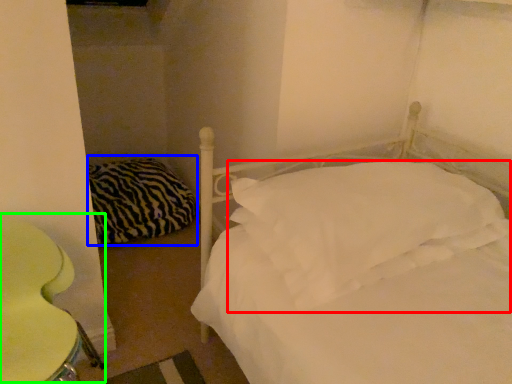
Question: Considering the real-world distances, which object is closest to pillow (highlighted by a red box)? pillow (highlighted by a blue box) or swivel chair (highlighted by a green box).

Choices:
 (A) pillow
 (B) swivel chair

Answer: (B)